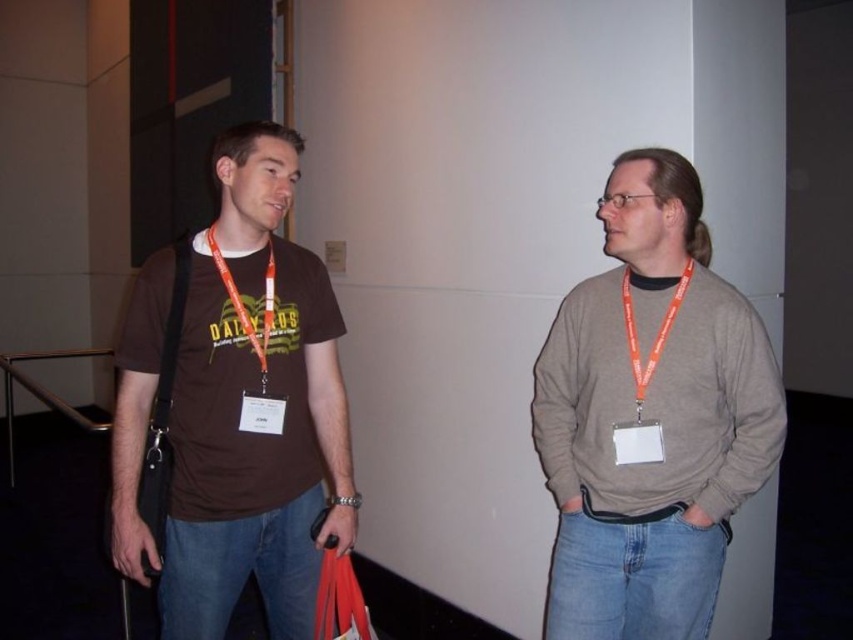
Can you confirm if brown cotton t-shirt at left is positioned to the left of orange fabric lanyard at left?

Indeed, brown cotton t-shirt at left is positioned on the left side of orange fabric lanyard at left.

Which is in front, point (235, 404) or point (271, 268)?

Point (235, 404)

Where is `brown cotton t-shirt at left`? Image resolution: width=853 pixels, height=640 pixels. brown cotton t-shirt at left is located at coordinates (235, 435).

Does orange lanyard at center have a smaller size compared to orange fabric lanyard at left?

Correct, orange lanyard at center occupies less space than orange fabric lanyard at left.

Which is more to the right, orange lanyard at center or orange fabric lanyard at left?

orange lanyard at center

You are a GUI agent. You are given a task and a screenshot of the screen. Output one action in this format:
    pyautogui.click(x=<x>, y=<y>)
    Task: Click on the orange lanyard at center
    This screenshot has height=640, width=853.
    Given the screenshot: What is the action you would take?
    pyautogui.click(x=656, y=252)

Is matte orange lanyard at center bigger than orange fabric lanyard at left?

Incorrect, matte orange lanyard at center is not larger than orange fabric lanyard at left.

Can you confirm if matte orange lanyard at center is positioned to the left of orange fabric lanyard at left?

Yes, matte orange lanyard at center is to the left of orange fabric lanyard at left.

Does point (223, 196) come behind point (264, 340)?

That is True.

You are a GUI agent. You are given a task and a screenshot of the screen. Output one action in this format:
    pyautogui.click(x=<x>, y=<y>)
    Task: Click on the matte orange lanyard at center
    Image resolution: width=853 pixels, height=640 pixels.
    Given the screenshot: What is the action you would take?
    pyautogui.click(x=244, y=216)